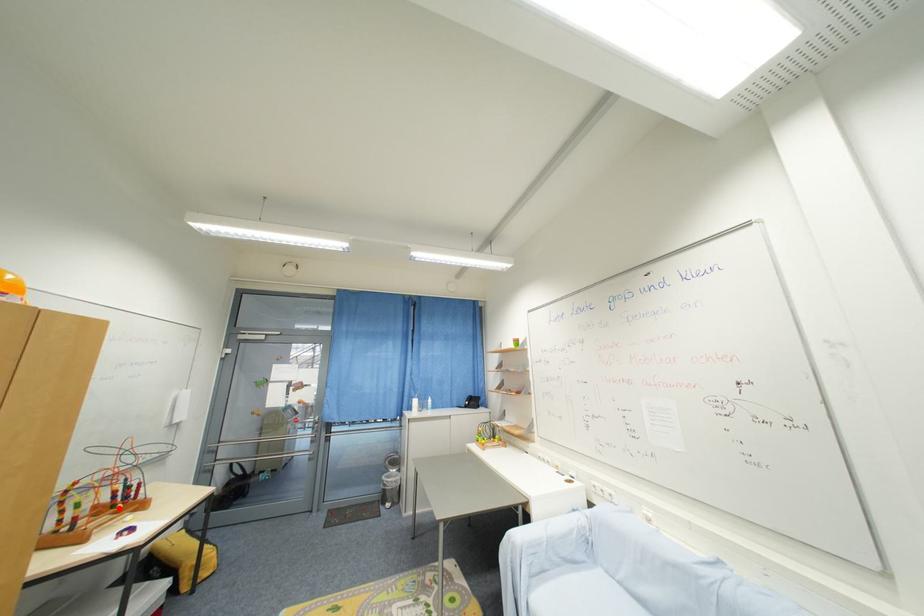
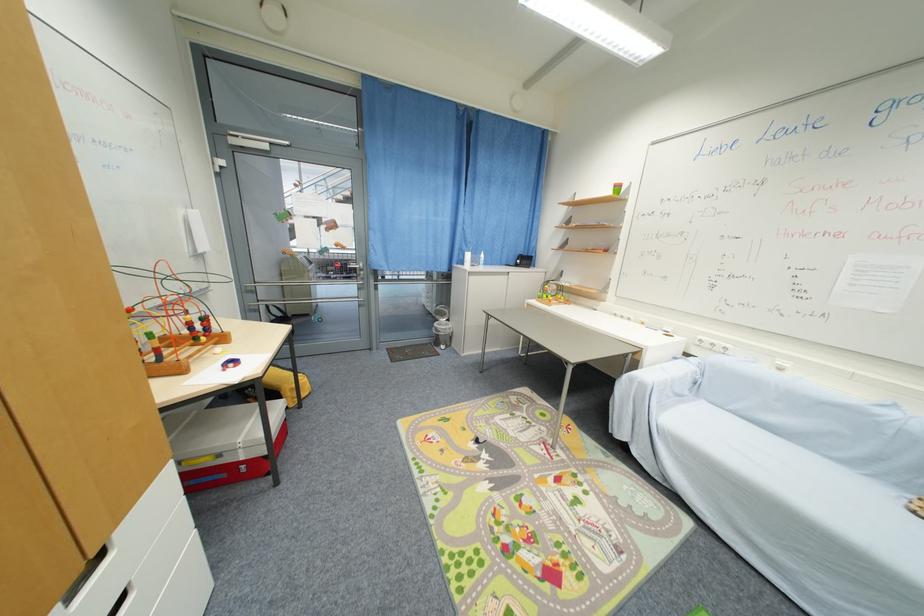
In the second image, find the point that corresponds to the highlighted location in the first image.

(201, 341)